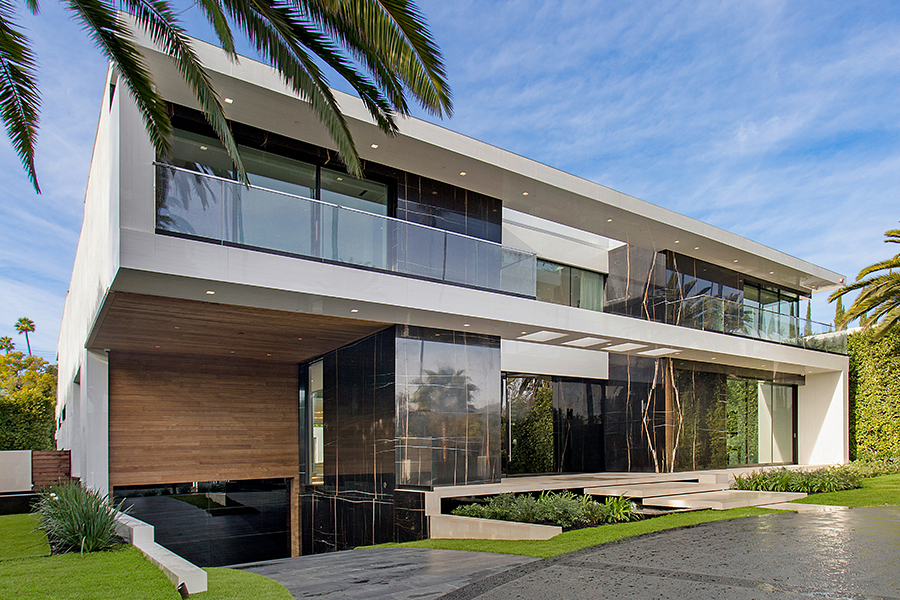
Identify the location of window. (270, 176), (330, 176).